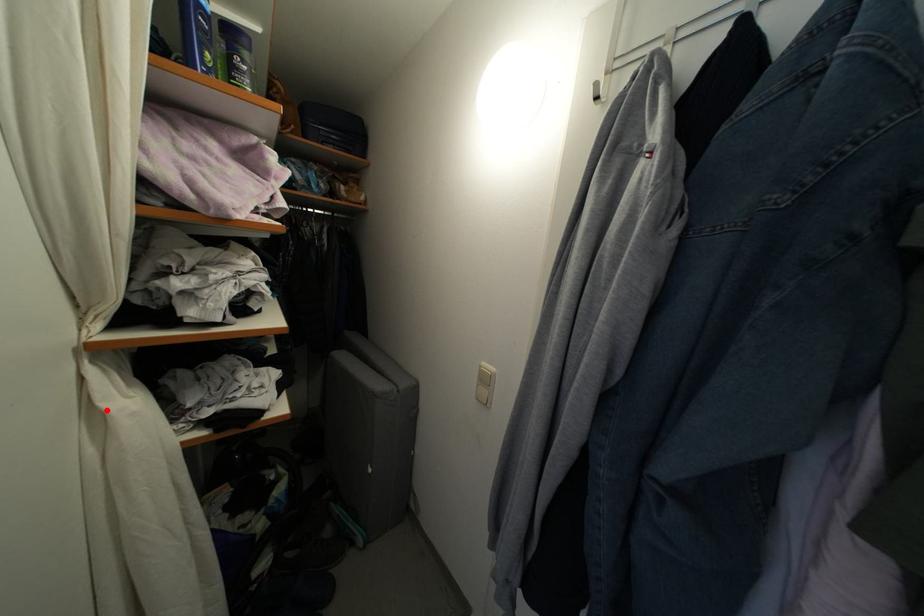
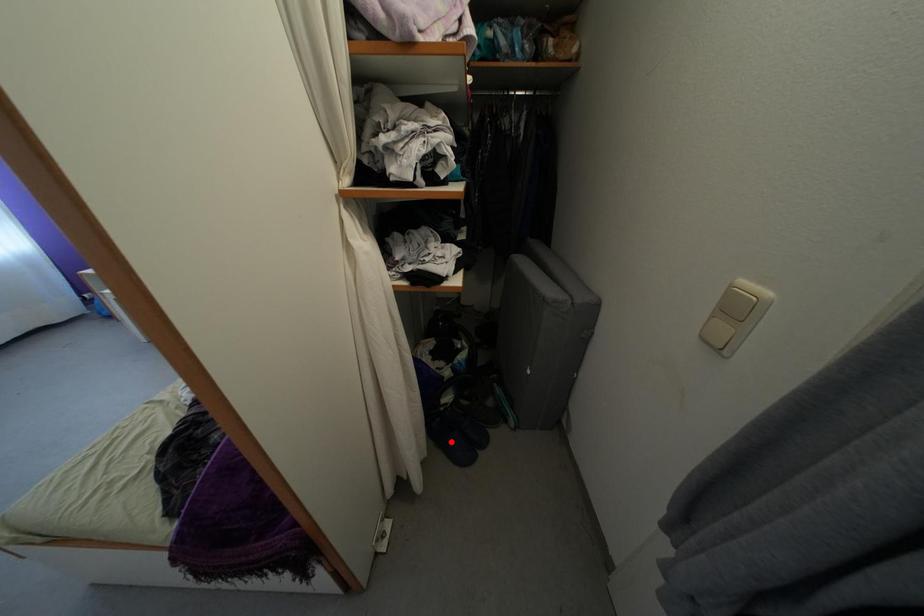
I am providing you with two images of the same scene from different viewpoints. A red point is marked on the first image and another point is marked on the second image. Is the marked point in image1 the same physical position as the marked point in image2?

No